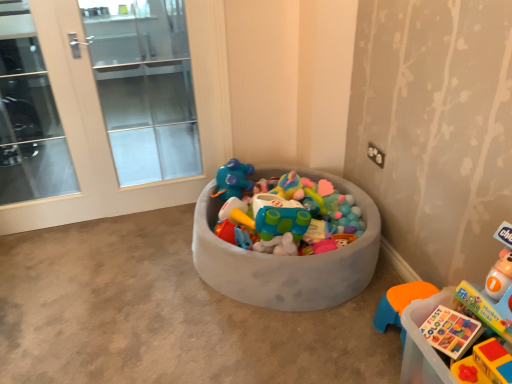
Describe the element at coordinates (424, 342) in the screenshot. The width and height of the screenshot is (512, 384). I see `translucent plastic book at lower right, which is the first toy from back to front` at that location.

You are a GUI agent. You are given a task and a screenshot of the screen. Output one action in this format:
    pyautogui.click(x=<x>, y=<y>)
    Task: Click on the white glass screen door at left, positioned as the second screen door in left-to-right order
    Image resolution: width=512 pixels, height=384 pixels.
    Given the screenshot: What is the action you would take?
    pyautogui.click(x=104, y=124)

This screenshot has width=512, height=384. What do you see at coordinates (28, 116) in the screenshot? I see `clear glass door at left, which appears as the 1th screen door when viewed from the left` at bounding box center [28, 116].

Measure the distance between point (486, 346) and camera.

Point (486, 346) is 1.10 meters from camera.

This screenshot has width=512, height=384. In order to click on translucent plastic book at lower right, which is the first toy from back to front in this screenshot , I will do pyautogui.click(x=424, y=342).

Is point (12, 77) more distant than point (196, 313)?

Yes.

Does clear glass door at left, which appears as the 1th screen door when viewed from the left, have a greater width compared to gray fabric toy bin at center?

In fact, clear glass door at left, which appears as the 1th screen door when viewed from the left, might be narrower than gray fabric toy bin at center.

In the scene shown: From the image's perspective, is clear glass door at left, which appears as the 1th screen door when viewed from the left, located beneath gray fabric toy bin at center?

No, from the image's perspective, clear glass door at left, which appears as the 1th screen door when viewed from the left, is not beneath gray fabric toy bin at center.

Is translucent plastic book at lower right, the second toy from the front, far away from clear glass door at left, which appears as the 1th screen door when viewed from the left?

translucent plastic book at lower right, the second toy from the front, is positioned a significant distance from clear glass door at left, which appears as the 1th screen door when viewed from the left.

Which is in front, point (428, 369) or point (57, 186)?

The point (428, 369) is closer to the camera.

Is translucent plastic book at lower right, the second toy from the front, surrounding clear glass door at left, the 2th screen door viewed from the right?

No.

From the image's perspective, between translucent plastic book at lower right, the second toy from the front, and clear glass door at left, the 2th screen door viewed from the right, which one is located above?

clear glass door at left, the 2th screen door viewed from the right.

Considering the sizes of objects translucent plastic book at lower right, the second toy from the front, and rubberized plastic toy at lower right, which appears as the first toy when viewed from the front, in the image provided, who is bigger, translucent plastic book at lower right, the second toy from the front, or rubberized plastic toy at lower right, which appears as the first toy when viewed from the front,?

Bigger between the two is translucent plastic book at lower right, the second toy from the front.

From the picture: How far apart are translucent plastic book at lower right, which is the first toy from back to front, and rubberized plastic toy at lower right, the second toy viewed from the back?

translucent plastic book at lower right, which is the first toy from back to front, and rubberized plastic toy at lower right, the second toy viewed from the back, are 6.35 inches apart.

Would you say translucent plastic book at lower right, the second toy from the front, is to the left or to the right of rubberized plastic toy at lower right, the second toy viewed from the back, in the picture?

translucent plastic book at lower right, the second toy from the front, is to the right of rubberized plastic toy at lower right, the second toy viewed from the back.

Considering the positions of objects translucent plastic book at lower right, which is the first toy from back to front, and rubberized plastic toy at lower right, which appears as the first toy when viewed from the front, in the image provided, who is in front, translucent plastic book at lower right, which is the first toy from back to front, or rubberized plastic toy at lower right, which appears as the first toy when viewed from the front,?

rubberized plastic toy at lower right, which appears as the first toy when viewed from the front, is in front.

Is translucent plastic book at lower right, the second toy from the front, wider or thinner than white glass screen door at left, positioned as the second screen door in left-to-right order?

Clearly, translucent plastic book at lower right, the second toy from the front, has more width compared to white glass screen door at left, positioned as the second screen door in left-to-right order.

Is translucent plastic book at lower right, which is the first toy from back to front, taller or shorter than white glass screen door at left, which ranks as the 1th screen door in right-to-left order?

In the image, translucent plastic book at lower right, which is the first toy from back to front, appears to be shorter than white glass screen door at left, which ranks as the 1th screen door in right-to-left order.

Is translucent plastic book at lower right, the second toy from the front, to the right of white glass screen door at left, positioned as the second screen door in left-to-right order, from the viewer's perspective?

Yes, translucent plastic book at lower right, the second toy from the front, is to the right of white glass screen door at left, positioned as the second screen door in left-to-right order.

Does translucent plastic book at lower right, the second toy from the front, contain white glass screen door at left, positioned as the second screen door in left-to-right order?

That's incorrect, white glass screen door at left, positioned as the second screen door in left-to-right order, is not inside translucent plastic book at lower right, the second toy from the front.

In order to click on the 1st toy to the right of the clear glass door at left, the 2th screen door viewed from the right, starting your count from the anchor in this screenshot , I will do `click(486, 364)`.

Can you confirm if rubberized plastic toy at lower right, the second toy viewed from the back, is bigger than clear glass door at left, which appears as the 1th screen door when viewed from the left?

Incorrect, rubberized plastic toy at lower right, the second toy viewed from the back, is not larger than clear glass door at left, which appears as the 1th screen door when viewed from the left.

From a real-world perspective, between rubberized plastic toy at lower right, which appears as the first toy when viewed from the front, and clear glass door at left, the 2th screen door viewed from the right, who is vertically lower?

rubberized plastic toy at lower right, which appears as the first toy when viewed from the front, from a real-world perspective.

Is rubberized plastic toy at lower right, which appears as the first toy when viewed from the front, wider than clear glass door at left, the 2th screen door viewed from the right?

Yes, rubberized plastic toy at lower right, which appears as the first toy when viewed from the front, is wider than clear glass door at left, the 2th screen door viewed from the right.

Can you confirm if rubberized plastic toy at lower right, the second toy viewed from the back, is thinner than translucent plastic book at lower right, the second toy from the front?

Yes, rubberized plastic toy at lower right, the second toy viewed from the back, is thinner than translucent plastic book at lower right, the second toy from the front.

Between rubberized plastic toy at lower right, the second toy viewed from the back, and translucent plastic book at lower right, which is the first toy from back to front, which one appears on the left side from the viewer's perspective?

rubberized plastic toy at lower right, the second toy viewed from the back, is more to the left.

Could you tell me if rubberized plastic toy at lower right, the second toy viewed from the back, is facing translucent plastic book at lower right, which is the first toy from back to front?

No, rubberized plastic toy at lower right, the second toy viewed from the back, is not facing towards translucent plastic book at lower right, which is the first toy from back to front.

Is point (492, 347) closer to viewer compared to point (445, 371)?

Yes, point (492, 347) is closer to viewer.

Would you consider rubberized plastic toy at lower right, the second toy viewed from the back, to be distant from white glass screen door at left, positioned as the second screen door in left-to-right order?

rubberized plastic toy at lower right, the second toy viewed from the back, is positioned a significant distance from white glass screen door at left, positioned as the second screen door in left-to-right order.

From a real-world perspective, is rubberized plastic toy at lower right, which appears as the first toy when viewed from the front, below white glass screen door at left, positioned as the second screen door in left-to-right order?

Correct, in the physical world, rubberized plastic toy at lower right, which appears as the first toy when viewed from the front, is lower than white glass screen door at left, positioned as the second screen door in left-to-right order.

Find the location of a particular element. Image resolution: width=512 pixels, height=384 pixels. concrete in front of the clear glass door at left, which appears as the 1th screen door when viewed from the left is located at coordinates (167, 314).

From a real-world perspective, starting from the translucent plastic book at lower right, which is the first toy from back to front, which screen door is the 2nd one vertically above it? Please provide its 2D coordinates.

[(28, 116)]

When comparing their distances from translucent plastic book at lower right, which is the first toy from back to front, does rubberized plastic toy at lower right, which appears as the first toy when viewed from the front, or clear glass door at left, which appears as the 1th screen door when viewed from the left, seem further?

Based on the image, clear glass door at left, which appears as the 1th screen door when viewed from the left, appears to be further to translucent plastic book at lower right, which is the first toy from back to front.

Consider the image. Which object lies nearer to the anchor point white glass screen door at left, positioned as the second screen door in left-to-right order, gray fabric toy bin at center or clear glass door at left, the 2th screen door viewed from the right?

gray fabric toy bin at center.

Based on their spatial positions, is translucent plastic book at lower right, the second toy from the front, or rubberized plastic toy at lower right, which appears as the first toy when viewed from the front, closer to gray fabric toy bin at center?

translucent plastic book at lower right, the second toy from the front.

From the image, which object appears to be nearer to gray fabric toy bin at center, white glass screen door at left, which ranks as the 1th screen door in right-to-left order, or translucent plastic book at lower right, which is the first toy from back to front?

white glass screen door at left, which ranks as the 1th screen door in right-to-left order.

Based on their spatial positions, is gray fabric toy bin at center or rubberized plastic toy at lower right, which appears as the first toy when viewed from the front, further from clear glass door at left, which appears as the 1th screen door when viewed from the left?

The object further to clear glass door at left, which appears as the 1th screen door when viewed from the left, is rubberized plastic toy at lower right, which appears as the first toy when viewed from the front.

From the image, which object appears to be nearer to rubberized plastic toy at lower right, which appears as the first toy when viewed from the front, clear glass door at left, which appears as the 1th screen door when viewed from the left, or white glass screen door at left, positioned as the second screen door in left-to-right order?

The object closer to rubberized plastic toy at lower right, which appears as the first toy when viewed from the front, is white glass screen door at left, positioned as the second screen door in left-to-right order.

When comparing their distances from translucent plastic book at lower right, which is the first toy from back to front, does clear glass door at left, which appears as the 1th screen door when viewed from the left, or white glass screen door at left, positioned as the second screen door in left-to-right order, seem closer?

white glass screen door at left, positioned as the second screen door in left-to-right order.

From the image, which object appears to be farther from white glass screen door at left, which ranks as the 1th screen door in right-to-left order, clear glass door at left, the 2th screen door viewed from the right, or rubberized plastic toy at lower right, the second toy viewed from the back?

rubberized plastic toy at lower right, the second toy viewed from the back.

I want to click on toy between clear glass door at left, the 2th screen door viewed from the right, and translucent plastic book at lower right, the second toy from the front, from left to right, so click(486, 364).

In order to click on toy between gray fabric toy bin at center and translucent plastic book at lower right, which is the first toy from back to front, in the horizontal direction in this screenshot , I will do tap(486, 364).

Identify the location of screen door between clear glass door at left, which appears as the 1th screen door when viewed from the left, and rubberized plastic toy at lower right, the second toy viewed from the back. The width and height of the screenshot is (512, 384). (104, 124).

Identify the location of screen door between clear glass door at left, the 2th screen door viewed from the right, and translucent plastic book at lower right, the second toy from the front, in the horizontal direction. This screenshot has height=384, width=512. (104, 124).